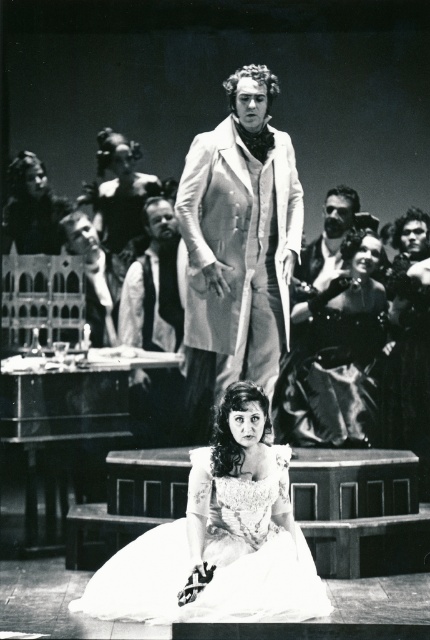
Question: Considering the relative positions of silvery metallic coat at center and shiny black dress at center in the image provided, where is silvery metallic coat at center located with respect to shiny black dress at center?

Choices:
 (A) above
 (B) below

Answer: (A)

Question: Which of the following is the farthest from the observer?

Choices:
 (A) silvery metallic coat at center
 (B) shiny black dress at center
 (C) white satin dress at lower center

Answer: (B)

Question: Can you confirm if white satin dress at lower center is positioned to the left of shiny black dress at center?

Choices:
 (A) yes
 (B) no

Answer: (A)

Question: Estimate the real-world distances between objects in this image. Which object is closer to the shiny black dress at center?

Choices:
 (A) white satin dress at lower center
 (B) silvery metallic coat at center

Answer: (B)

Question: Among these objects, which one is nearest to the camera?

Choices:
 (A) silvery metallic coat at center
 (B) shiny black dress at center

Answer: (A)

Question: From the image, what is the correct spatial relationship of silvery metallic coat at center in relation to white satin dress at lower center?

Choices:
 (A) below
 (B) above

Answer: (B)